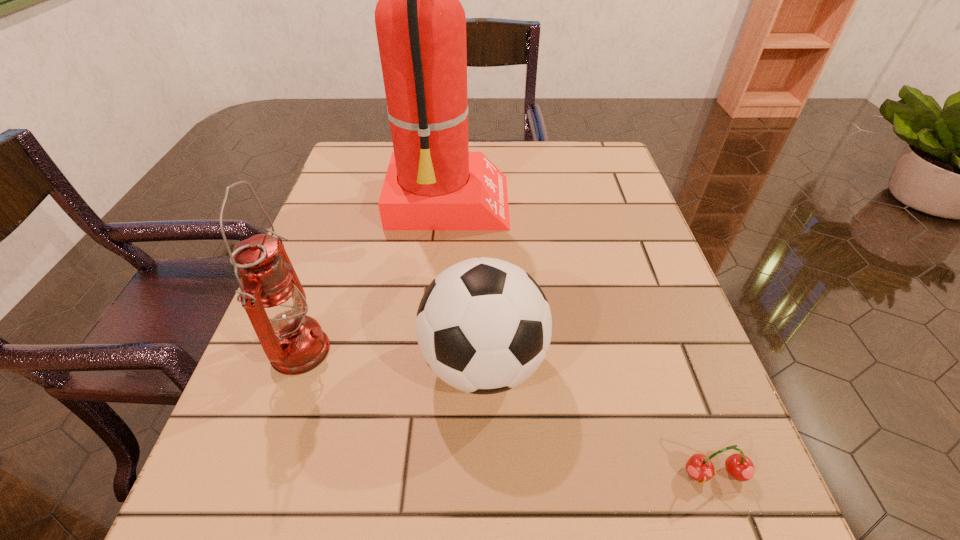
At what (x,y) coordinates should I click in order to perform the action: click on fire extinguisher. Please return your answer as a coordinate pair (x, y). This screenshot has height=540, width=960. Looking at the image, I should click on (433, 182).

Identify the location of the tallest object. The image size is (960, 540). (433, 182).

Where is `oil lamp`? oil lamp is located at coordinates (271, 293).

The width and height of the screenshot is (960, 540). Identify the location of the second tallest object. (271, 293).

This screenshot has height=540, width=960. Identify the location of the third tallest object. (483, 326).

Where is `the nearest object`? The height and width of the screenshot is (540, 960). the nearest object is located at coordinates (699, 467).

At what (x,y) coordinates should I click in order to perform the action: click on the rightmost object. Please return your answer as a coordinate pair (x, y). The image size is (960, 540). Looking at the image, I should click on (699, 467).

What are the coordinates of `free space located on the front-facing side of the fire extinguisher` in the screenshot? It's located at (619, 206).

Locate an element on the screen. Image resolution: width=960 pixels, height=540 pixels. blank space located on the right of the oil lamp is located at coordinates (489, 352).

What are the coordinates of `free region located 0.230m on the left of the second shortest object` in the screenshot? It's located at (283, 363).